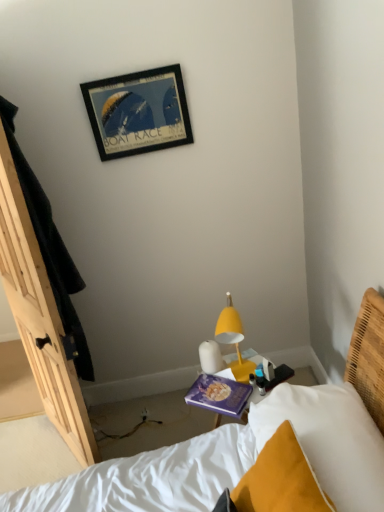
Question: Considering the relative positions of white soft pillow at lower right and yellow matte lamp at center-right in the image provided, is white soft pillow at lower right behind yellow matte lamp at center-right?

Choices:
 (A) yes
 (B) no

Answer: (B)

Question: Can you confirm if white soft pillow at lower right is taller than yellow matte lamp at center-right?

Choices:
 (A) no
 (B) yes

Answer: (B)

Question: Is yellow matte lamp at center-right a part of white soft pillow at lower right?

Choices:
 (A) yes
 (B) no

Answer: (B)

Question: Can you confirm if white soft pillow at lower right is shorter than yellow matte lamp at center-right?

Choices:
 (A) yes
 (B) no

Answer: (B)

Question: Does white soft pillow at lower right touch yellow matte lamp at center-right?

Choices:
 (A) no
 (B) yes

Answer: (A)

Question: From the image's perspective, is white soft pillow at lower right on top of yellow matte lamp at center-right?

Choices:
 (A) yes
 (B) no

Answer: (B)

Question: Considering the relative sizes of yellow matte lamp at center-right and purple matte book at center in the image provided, is yellow matte lamp at center-right taller than purple matte book at center?

Choices:
 (A) no
 (B) yes

Answer: (B)

Question: Is yellow matte lamp at center-right to the left of purple matte book at center from the viewer's perspective?

Choices:
 (A) yes
 (B) no

Answer: (B)

Question: From the image's perspective, is yellow matte lamp at center-right on top of purple matte book at center?

Choices:
 (A) yes
 (B) no

Answer: (A)

Question: Considering the relative sizes of yellow matte lamp at center-right and purple matte book at center in the image provided, is yellow matte lamp at center-right smaller than purple matte book at center?

Choices:
 (A) no
 (B) yes

Answer: (A)

Question: Can you confirm if yellow matte lamp at center-right is thinner than purple matte book at center?

Choices:
 (A) no
 (B) yes

Answer: (B)

Question: Is yellow matte lamp at center-right looking in the opposite direction of purple matte book at center?

Choices:
 (A) no
 (B) yes

Answer: (A)

Question: Can you confirm if white soft pillow at lower right is positioned to the right of purple matte book at center?

Choices:
 (A) yes
 (B) no

Answer: (A)